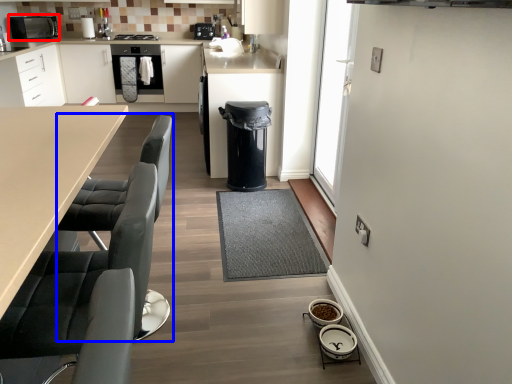
Question: Among these objects, which one is nearest to the camera, home appliance (highlighted by a red box) or swivel chair (highlighted by a blue box)?

Choices:
 (A) home appliance
 (B) swivel chair

Answer: (B)